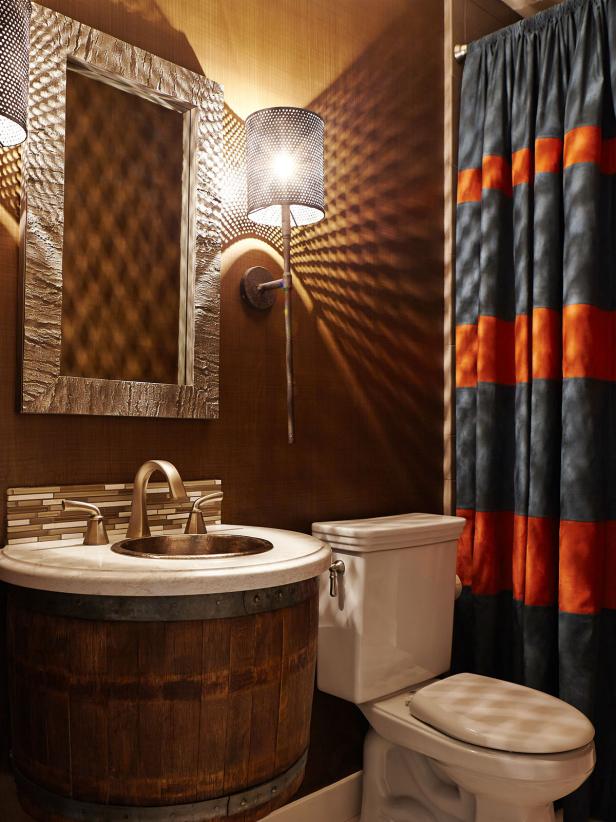
Find the location of a particular element. This screenshot has width=616, height=822. faucet is located at coordinates (171, 500).